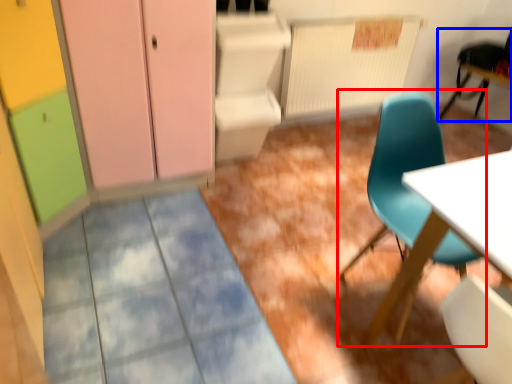
Question: Which of the following is the closest to the observer, chair (highlighted by a red box) or chair (highlighted by a blue box)?

Choices:
 (A) chair
 (B) chair

Answer: (A)